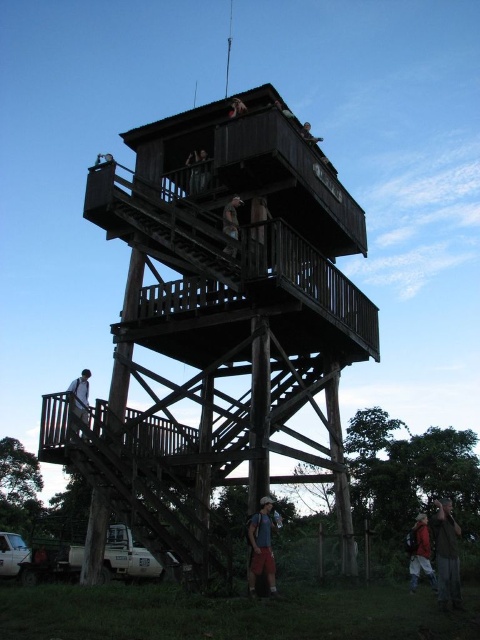
Can you confirm if dark wood observation tower at center is positioned below wooden stairs at center?

Yes.

This screenshot has width=480, height=640. What do you see at coordinates (220, 323) in the screenshot? I see `dark wood observation tower at center` at bounding box center [220, 323].

Find the location of a particular element. dark wood observation tower at center is located at coordinates (220, 323).

How far apart are wooden person at center and wooden helmet at upper center?

wooden person at center is 29.13 feet away from wooden helmet at upper center.

Looking at this image, between wooden person at center and wooden helmet at upper center, which one is positioned higher?

wooden helmet at upper center is above.

Who is more distant from viewer, (232, 230) or (240, 108)?

The point (240, 108) is behind.

Identify the location of wooden person at center. Image resolution: width=480 pixels, height=640 pixels. (231, 218).

Which of these two, wooden stairs at center or wooden helmet at upper center, stands shorter?

With less height is wooden helmet at upper center.

How far apart are wooden stairs at center and wooden helmet at upper center?

A distance of 25.83 meters exists between wooden stairs at center and wooden helmet at upper center.

Is point (90, 376) less distant than point (238, 113)?

No.

Find the location of a particular element. wooden stairs at center is located at coordinates (81, 394).